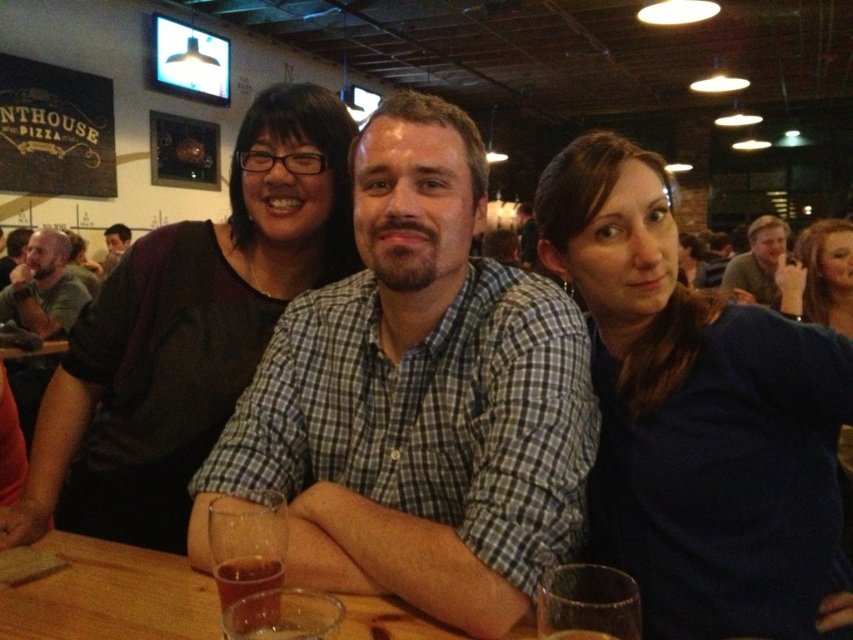
Is wooden table at center above matte blue shirt at center?

No, wooden table at center is not above matte blue shirt at center.

Is point (1, 593) positioned in front of point (840, 236)?

Yes, it is in front of point (840, 236).

Identify the location of wooden table at center. Image resolution: width=853 pixels, height=640 pixels. (109, 595).

I want to click on wooden table at center, so click(x=109, y=595).

Looking at this image, which of these two, blue matte shirt at center or matte black shirt at center, stands taller?

With more height is matte black shirt at center.

Consider the image. Is blue matte shirt at center above matte black shirt at center?

Actually, blue matte shirt at center is below matte black shirt at center.

Which is in front, point (670, 532) or point (47, 468)?

Point (670, 532)

The height and width of the screenshot is (640, 853). Find the location of `blue matte shirt at center`. blue matte shirt at center is located at coordinates (698, 417).

Does green shirt at upper right have a larger size compared to translucent glass at table center?

Yes.

Is green shirt at upper right behind translucent glass at table center?

Yes, green shirt at upper right is behind translucent glass at table center.

Describe the element at coordinates (757, 262) in the screenshot. I see `green shirt at upper right` at that location.

What are the coordinates of `green shirt at upper right` in the screenshot? It's located at (757, 262).